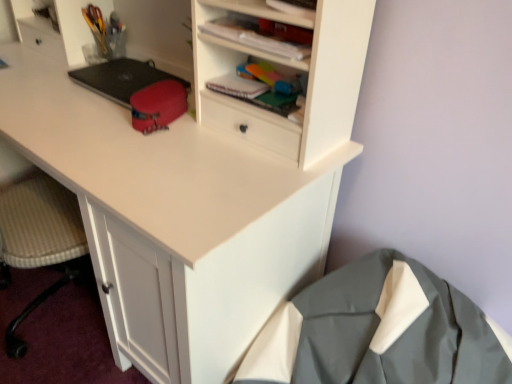
Question: From the image's perspective, is matte red pouch at center, which is counted as the second stationery, starting from the back, above matte white cabinet at upper center?

Choices:
 (A) no
 (B) yes

Answer: (A)

Question: Is matte red pouch at center, which is counted as the second stationery, starting from the back, not within matte white cabinet at upper center?

Choices:
 (A) yes
 (B) no

Answer: (A)

Question: Considering the relative sizes of matte red pouch at center, acting as the first stationery starting from the bottom, and matte white cabinet at upper center in the image provided, is matte red pouch at center, acting as the first stationery starting from the bottom, bigger than matte white cabinet at upper center?

Choices:
 (A) no
 (B) yes

Answer: (B)

Question: Is matte red pouch at center, which ranks as the first stationery in front-to-back order, next to matte white cabinet at upper center?

Choices:
 (A) no
 (B) yes

Answer: (A)

Question: Is matte red pouch at center, which is the 2th stationery in left-to-right order, to the left of matte white cabinet at upper center from the viewer's perspective?

Choices:
 (A) no
 (B) yes

Answer: (B)

Question: From a real-world perspective, is matte red pouch at center, which ranks as the first stationery in front-to-back order, located beneath matte white cabinet at upper center?

Choices:
 (A) no
 (B) yes

Answer: (B)

Question: Is black matte laptop at left bigger than translucent plastic container at upper left, the second stationery when ordered from right to left?

Choices:
 (A) yes
 (B) no

Answer: (A)

Question: Can you confirm if black matte laptop at left is smaller than translucent plastic container at upper left, the second stationery from the front?

Choices:
 (A) yes
 (B) no

Answer: (B)

Question: Can you confirm if black matte laptop at left is taller than translucent plastic container at upper left, the second stationery from the front?

Choices:
 (A) no
 (B) yes

Answer: (A)

Question: Considering the relative positions of black matte laptop at left and translucent plastic container at upper left, the second stationery from the front, in the image provided, is black matte laptop at left behind translucent plastic container at upper left, the second stationery from the front,?

Choices:
 (A) no
 (B) yes

Answer: (A)

Question: Considering the relative sizes of black matte laptop at left and translucent plastic container at upper left, the second stationery from the front, in the image provided, is black matte laptop at left wider than translucent plastic container at upper left, the second stationery from the front,?

Choices:
 (A) yes
 (B) no

Answer: (A)

Question: Is black matte laptop at left outside of translucent plastic container at upper left, placed as the first stationery when sorted from left to right?

Choices:
 (A) yes
 (B) no

Answer: (A)

Question: Is matte white cabinet at upper center smaller than matte red pouch at center, which is counted as the second stationery, starting from the back?

Choices:
 (A) yes
 (B) no

Answer: (A)